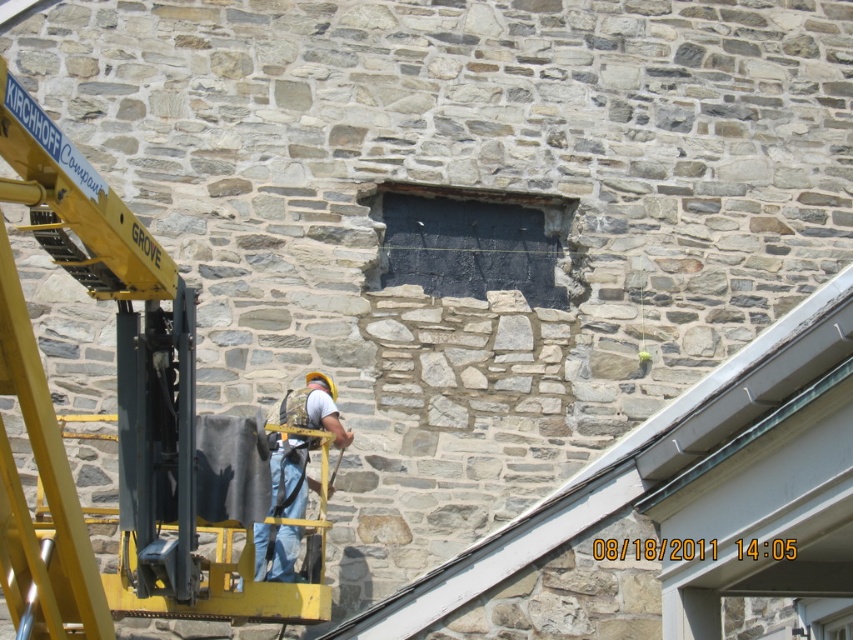
You are a construction worker who needs to move a heavy object from the left side of the scene to the right side. The yellow metal crane at left and denim jeans at center are in your way. Which object should you move first to create a clear path?

You should move the yellow metal crane at left first because its width is larger than the denim jeans at center, so removing it first would create more space for maneuvering the heavy object.

You are a construction worker standing at the point marked by the coordinates (117, 413). You need to move to the stone wall in the image. Which direction should you go to reach the stone wall?

The point marked by the coordinates (117, 413) is on the yellow metal crane at left, so you should move towards the right to reach the stone wall.

You are a construction worker needing to access the black stone hole at center. The yellow metal crane at left is blocking your path. Can you move around the crane to reach the hole?

The yellow metal crane at left is to the left of the black stone hole at center, so you can move around the crane by going to the right side of it to access the hole.